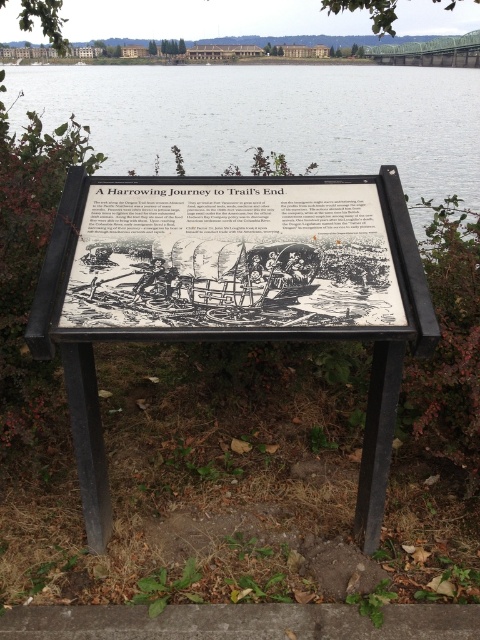
Is black wood sign at center to the right of transparent water at center from the viewer's perspective?

Correct, you'll find black wood sign at center to the right of transparent water at center.

Where is `black wood sign at center`? This screenshot has height=640, width=480. black wood sign at center is located at coordinates (231, 291).

Image resolution: width=480 pixels, height=640 pixels. What are the coordinates of `black wood sign at center` in the screenshot? It's located at (231, 291).